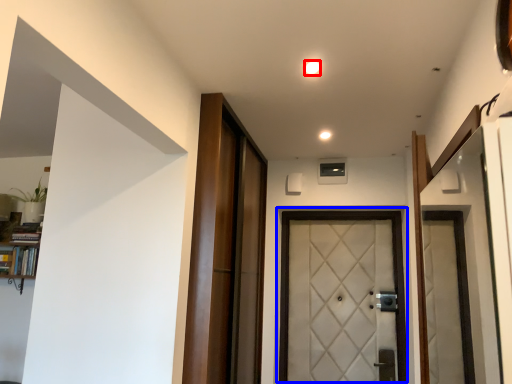
Question: Which object is closer to the camera taking this photo, light (highlighted by a red box) or door (highlighted by a blue box)?

Choices:
 (A) light
 (B) door

Answer: (A)